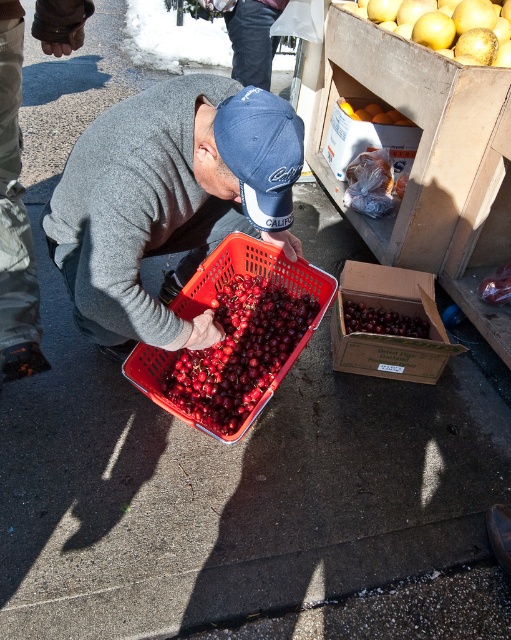
You are a customer at the market and want to buy both the golden smooth potatoes at upper right and the smooth orange fruit at center. Which one should you choose if you need something bigger in size?

The golden smooth potatoes at upper right has a larger size compared to the smooth orange fruit at center, so you should choose the golden smooth potatoes at upper right if you need something bigger in size.

You are a customer at the market and want to pick up both the cardboard box of cherries at center and the smooth orange fruit at center. Which one should you reach for first if you want to pick up the lower item first?

The cardboard box of cherries at center is located below the smooth orange fruit at center, so you should reach for the cardboard box of cherries at center first.

You are a customer at the market and want to pick cherries from the red plastic basket at center. The man is wearing a navy blue fabric baseball cap at center. To reach the basket, do you need to look up or down from the cap?

The navy blue fabric baseball cap at center is located above the red plastic basket at center, so you would need to look down from the cap to reach the basket.